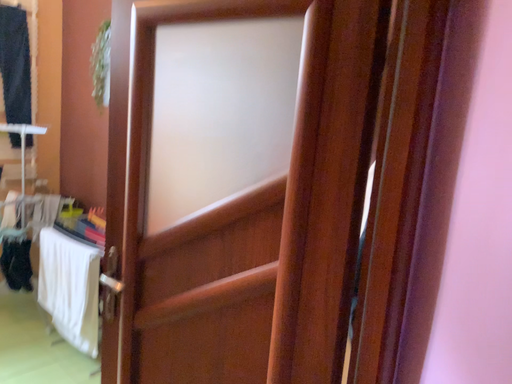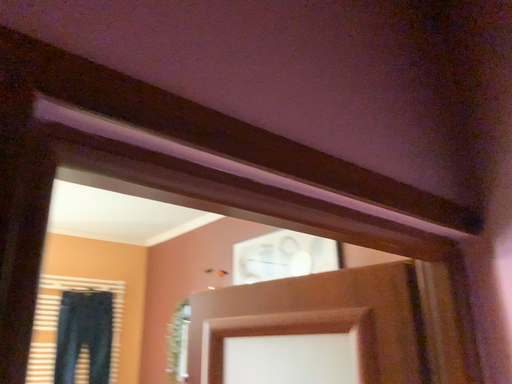
Question: How did the camera likely rotate when shooting the video?

Choices:
 (A) rotated right
 (B) rotated left

Answer: (B)